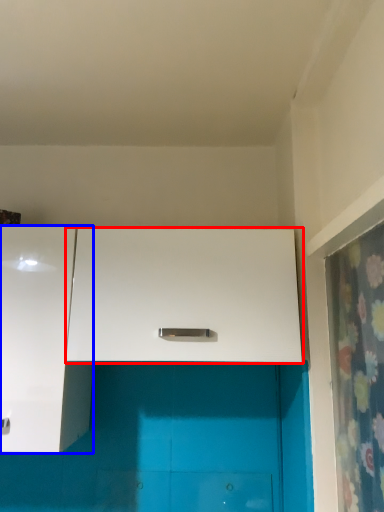
Question: Which point is closer to the camera, cabinetry (highlighted by a red box) or cabinetry (highlighted by a blue box)?

Choices:
 (A) cabinetry
 (B) cabinetry

Answer: (B)